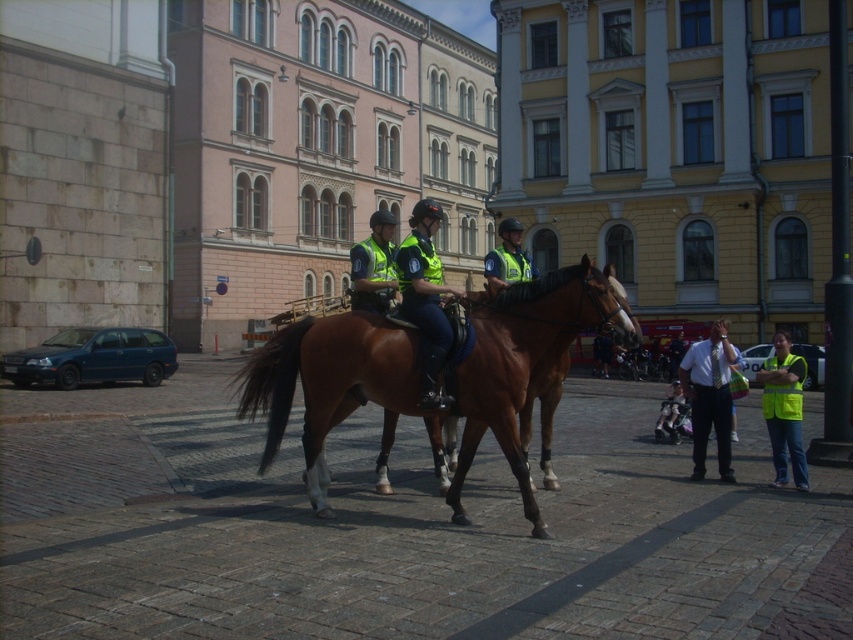
You are a pedestrian standing in the city square and want to cross the street. There are two police officers nearby. One is wearing a high visibility yellow vest at lower right, and the other is in a reflective blue uniform at center. The distance between them is 4.02 meters. If you need to ask for directions, which officer should you approach to minimize the distance you have to walk?

To minimize the distance you have to walk, you should approach the officer in the reflective blue uniform at center since they are closer to your current position in the city square compared to the high visibility yellow vest at lower right, which is 4.02 meters away from them.

From the picture: You are a pedestrian in the city square and want to cross the street safely. Which police officer should you look towards first, the one wearing the high visibility yellow vest at lower right or the reflective blue uniform at center?

You should look towards the reflective blue uniform at center first because the high visibility yellow vest at lower right is shorter than the reflective blue uniform at center, making the officer in the reflective blue uniform more visible from a distance.

You are a tourist standing in the city square and want to take a photo of the brown glossy horse at center and the neon yellow vest at lower right. Which object should you focus on first if you want both to be in clear focus?

The brown glossy horse at center is closer to the viewer than the neon yellow vest at lower right. To ensure both are in clear focus, you should focus on the brown glossy horse at center first since it is closer, and the neon yellow vest at lower right will be in focus as it is further away but within the depth of field.